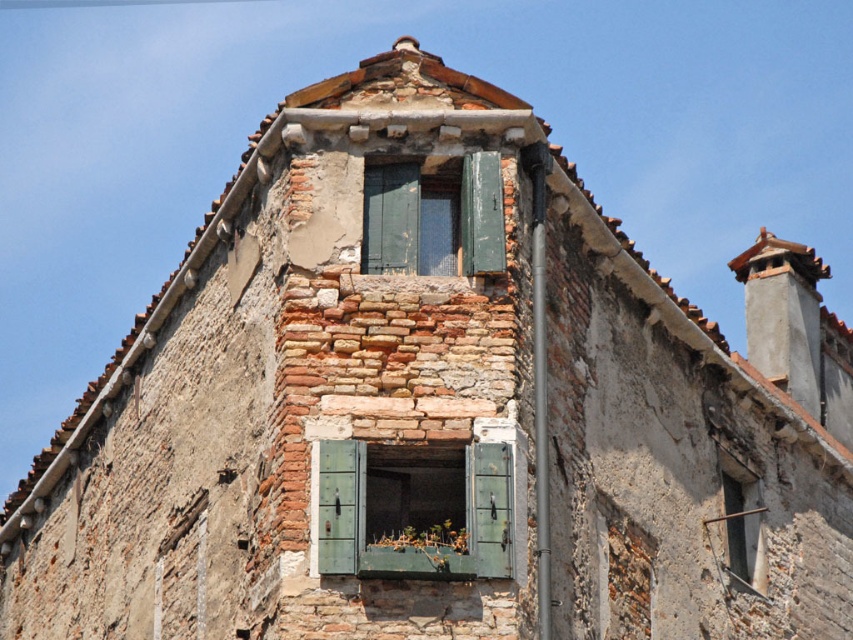
Which of these two, green painted wood at center or green wooden window at upper center, stands taller?

Standing taller between the two is green painted wood at center.

The image size is (853, 640). Find the location of `green painted wood at center`. green painted wood at center is located at coordinates (410, 516).

Is point (392, 480) farther from viewer compared to point (434, 184)?

No.

I want to click on green painted wood at center, so click(x=410, y=516).